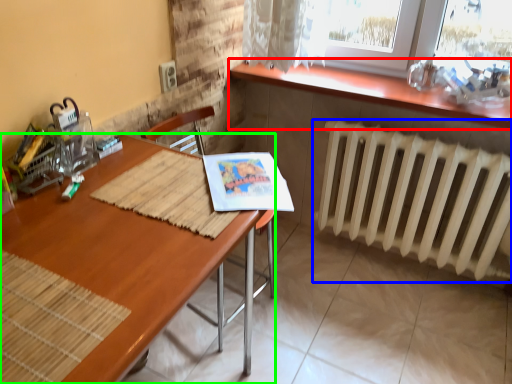
Question: Which is farther away from table (highlighted by a red box)? radiator (highlighted by a blue box) or desk (highlighted by a green box)?

Choices:
 (A) radiator
 (B) desk

Answer: (B)